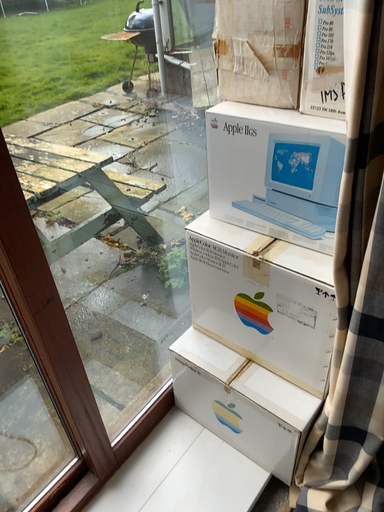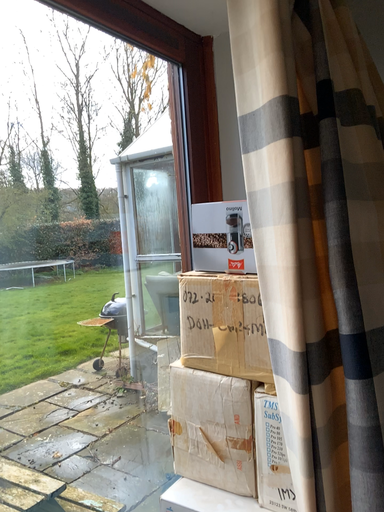
Question: How did the camera likely rotate when shooting the video?

Choices:
 (A) rotated upward
 (B) rotated downward

Answer: (A)